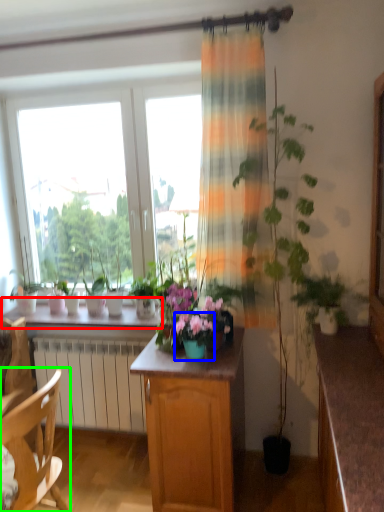
Question: Which object is positioned farthest from window sill (highlighted by a red box)? Select from flower box (highlighted by a blue box) and chair (highlighted by a green box).

Choices:
 (A) flower box
 (B) chair

Answer: (B)